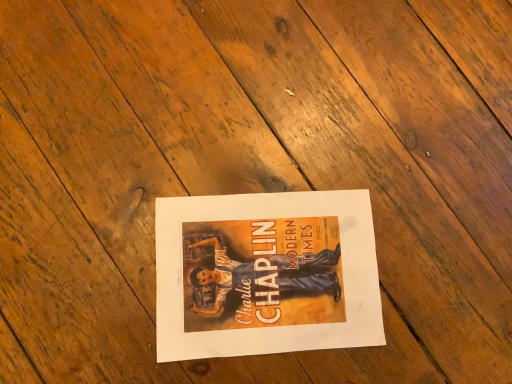
Find the location of a particular element. free point above matte paper poster at center (from a real-world perspective) is located at coordinates (264, 270).